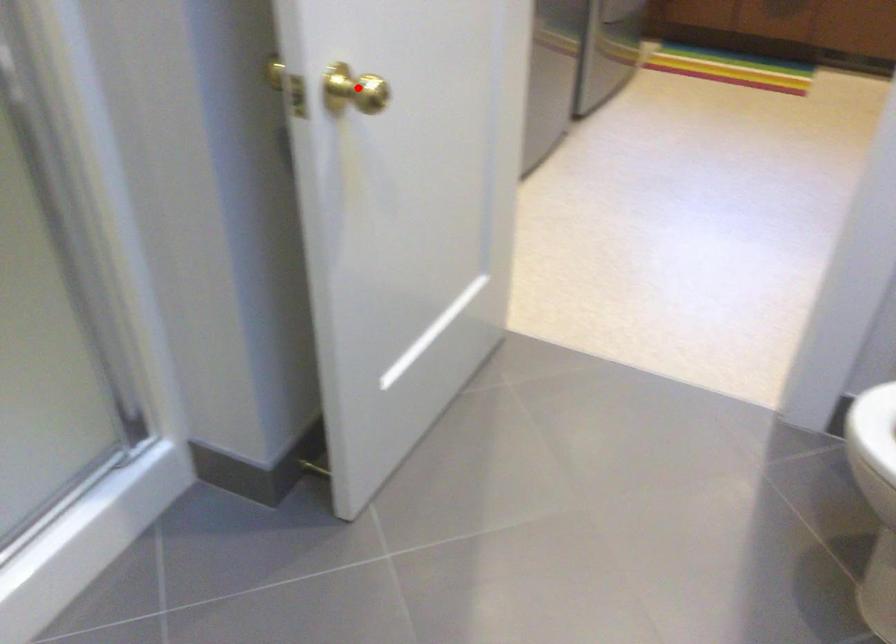
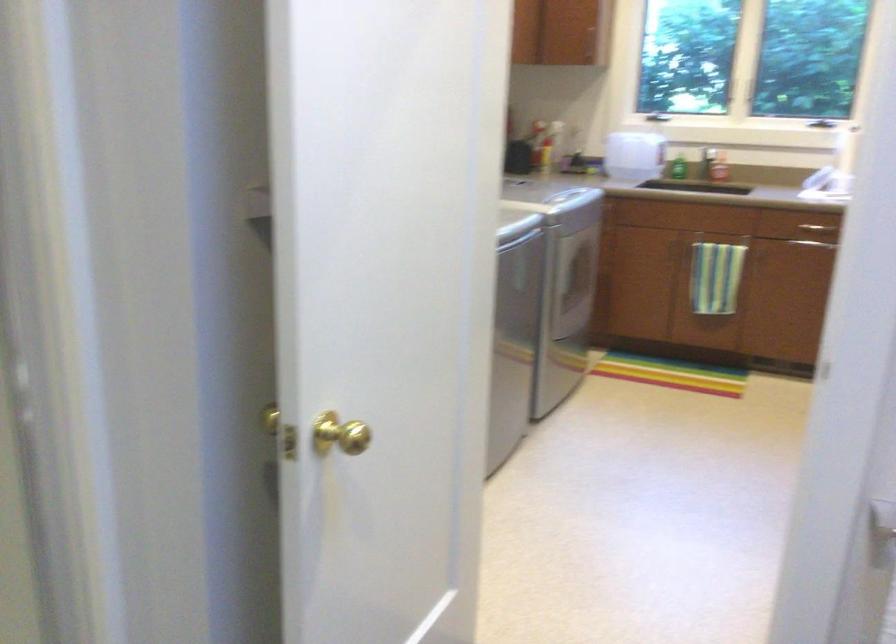
Question: A red point is marked in image1. In image2, is the corresponding 3D point closer to the camera or farther? Reply with the corresponding letter.

Choices:
 (A) The corresponding 3D point is closer.
 (B) The corresponding 3D point is farther.

Answer: (B)